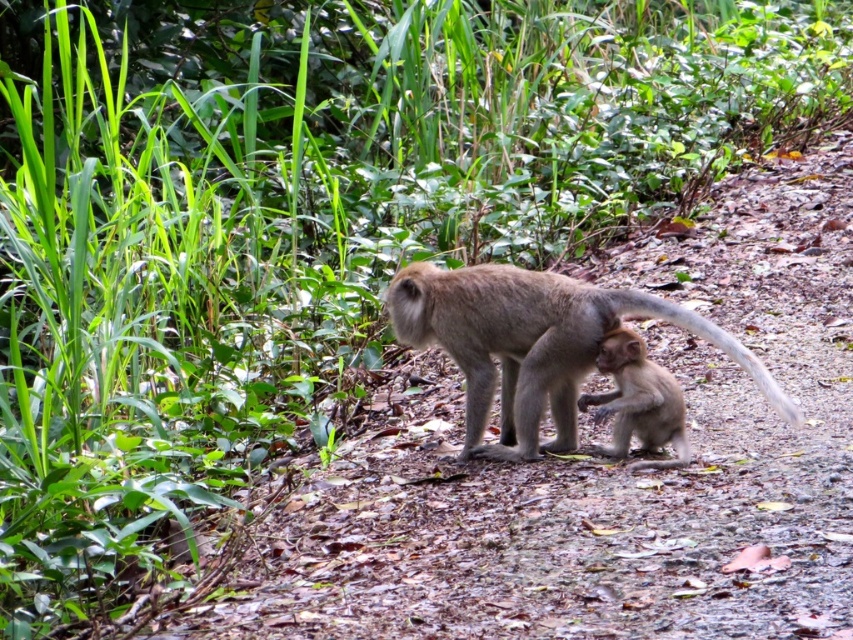
Can you confirm if brown furry monkey at center is wider than smooth brown monkey at center?

Yes.

Who is higher up, brown furry monkey at center or smooth brown monkey at center?

brown furry monkey at center

Is point (399, 301) positioned behind point (625, 440)?

Yes, point (399, 301) is farther from viewer.

The image size is (853, 640). Find the location of `brown furry monkey at center`. brown furry monkey at center is located at coordinates (532, 342).